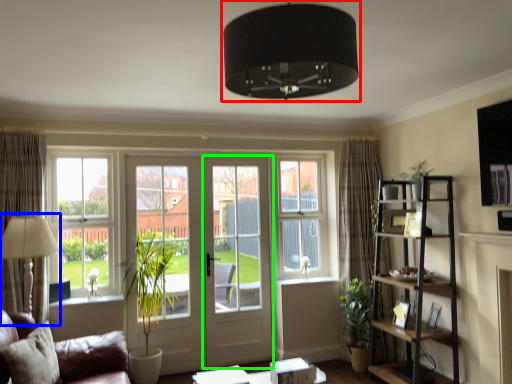
Question: Which object is positioned farthest from lamp (highlighted by a red box)? Select from table lamp (highlighted by a blue box) and screen door (highlighted by a green box).

Choices:
 (A) table lamp
 (B) screen door

Answer: (B)